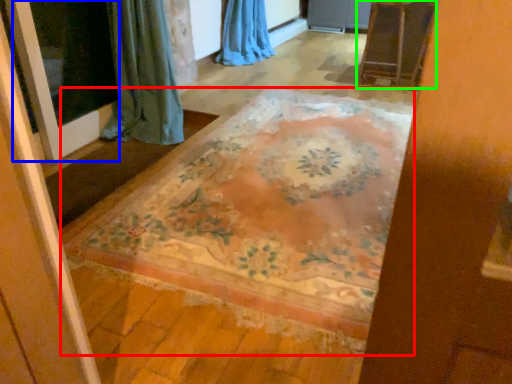
Question: Which is nearer to the mat (highlighted by a red box)? screen door (highlighted by a blue box) or furniture (highlighted by a green box).

Choices:
 (A) screen door
 (B) furniture

Answer: (A)